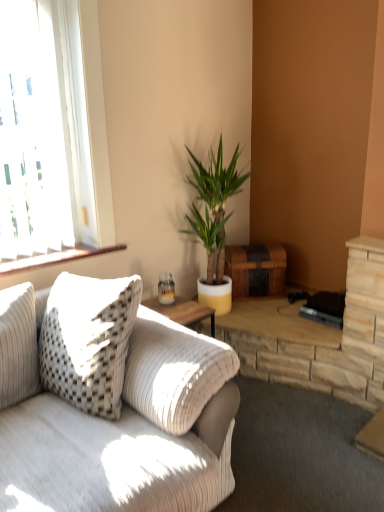
Question: Can you confirm if white corduroy couch at left is positioned to the left of clear glass window at upper left?

Choices:
 (A) yes
 (B) no

Answer: (B)

Question: Can we say white corduroy couch at left lies outside clear glass window at upper left?

Choices:
 (A) yes
 (B) no

Answer: (A)

Question: Is clear glass window at upper left inside white corduroy couch at left?

Choices:
 (A) yes
 (B) no

Answer: (B)

Question: From a real-world perspective, is white corduroy couch at left over clear glass window at upper left?

Choices:
 (A) yes
 (B) no

Answer: (B)

Question: Does white corduroy couch at left lie behind clear glass window at upper left?

Choices:
 (A) yes
 (B) no

Answer: (B)

Question: From the image's perspective, does white corduroy couch at left appear lower than clear glass window at upper left?

Choices:
 (A) yes
 (B) no

Answer: (A)

Question: Considering the relative sizes of clear glass window at upper left and white corduroy couch at left in the image provided, is clear glass window at upper left taller than white corduroy couch at left?

Choices:
 (A) no
 (B) yes

Answer: (B)

Question: Is clear glass window at upper left not inside white corduroy couch at left?

Choices:
 (A) no
 (B) yes

Answer: (B)

Question: From a real-world perspective, is clear glass window at upper left positioned over white corduroy couch at left based on gravity?

Choices:
 (A) no
 (B) yes

Answer: (B)

Question: Is clear glass window at upper left looking in the opposite direction of white corduroy couch at left?

Choices:
 (A) yes
 (B) no

Answer: (B)

Question: Is clear glass window at upper left next to white corduroy couch at left and touching it?

Choices:
 (A) yes
 (B) no

Answer: (B)

Question: Does clear glass window at upper left appear on the right side of white corduroy couch at left?

Choices:
 (A) yes
 (B) no

Answer: (B)

Question: Is green leafy plant at center located outside white corduroy couch at left?

Choices:
 (A) no
 (B) yes

Answer: (B)